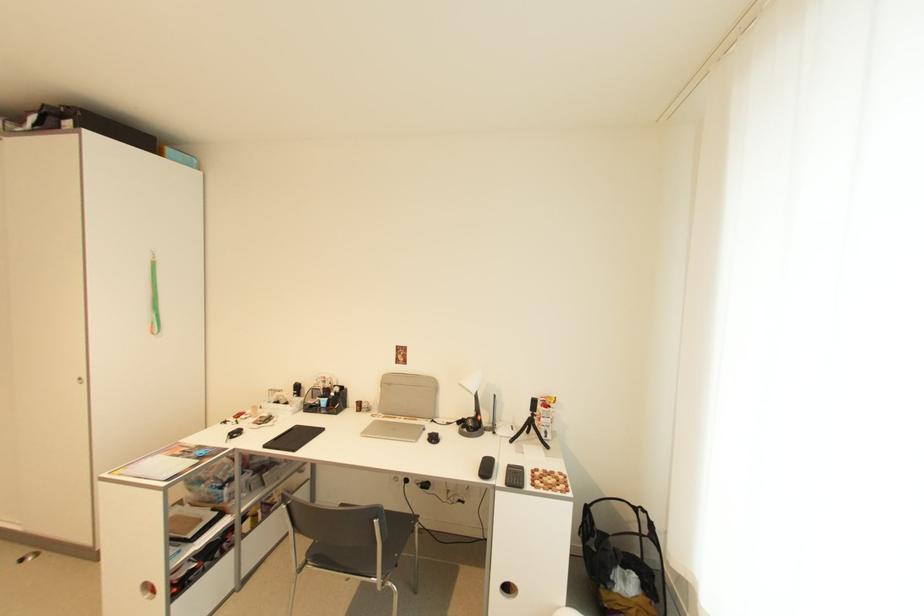
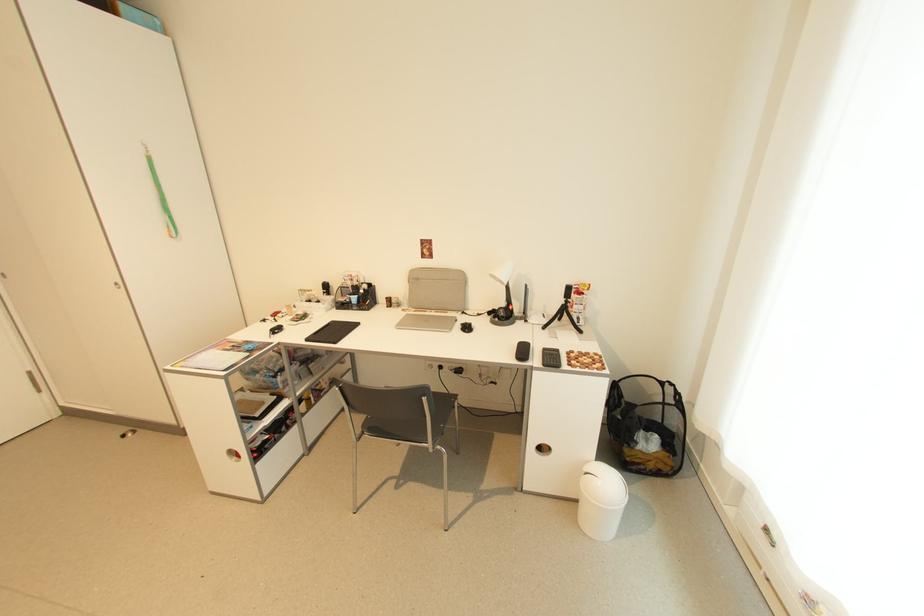
In the second image, find the point that corresponds to (310,564) in the first image.

(368, 434)